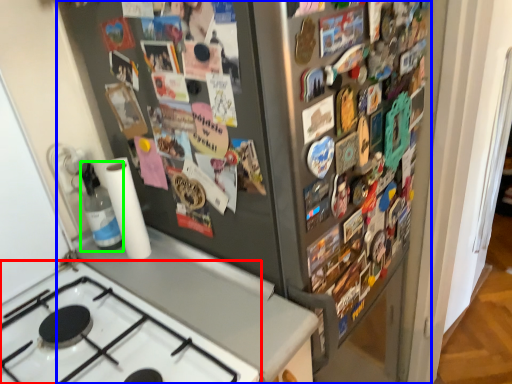
Question: Estimate the real-world distances between objects in this image. Which object is farther from gas stove (highlighted by a red box), refrigerator (highlighted by a blue box) or bottle (highlighted by a green box)?

Choices:
 (A) refrigerator
 (B) bottle

Answer: (A)